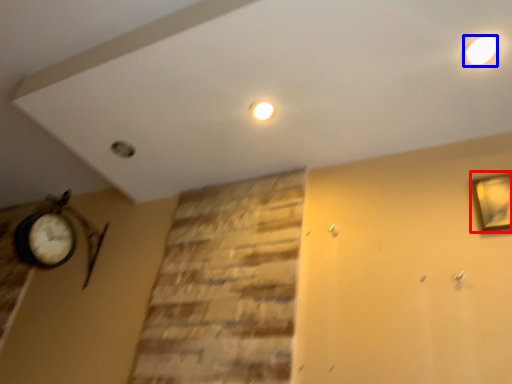
Question: Which object appears farthest to the camera in this image, picture frame (highlighted by a red box) or lighting (highlighted by a blue box)?

Choices:
 (A) picture frame
 (B) lighting

Answer: (A)